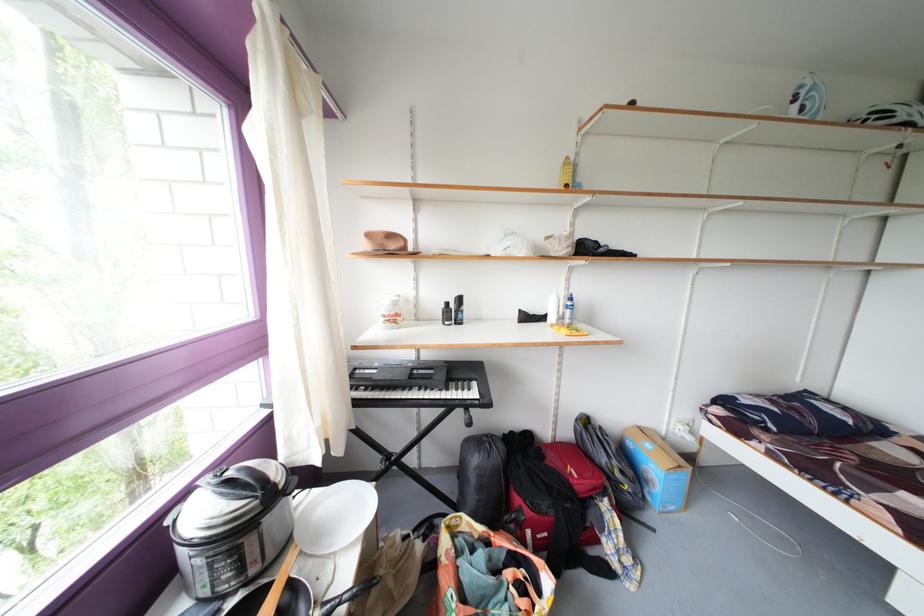
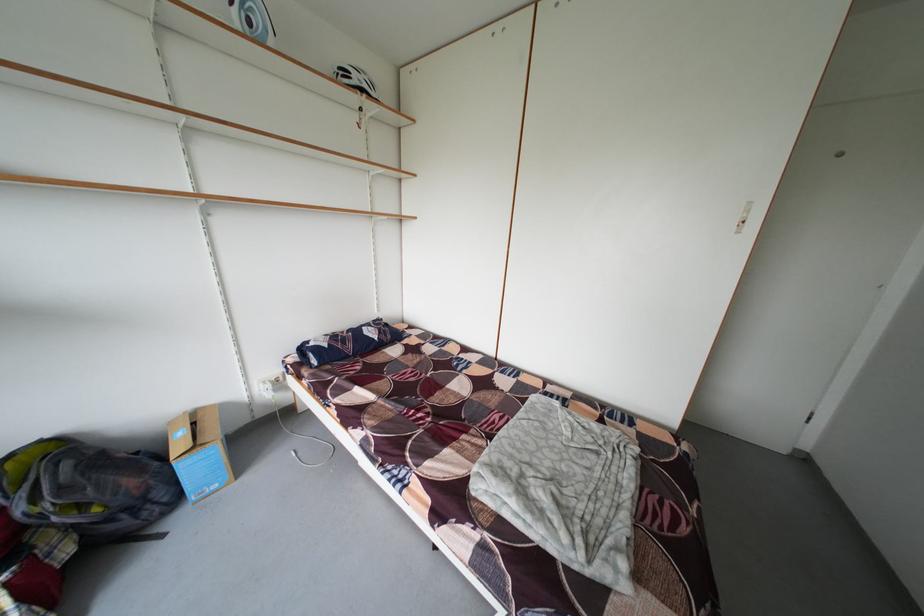
Where in the second image is the point corresponding to [613,464] from the first image?

(31, 515)